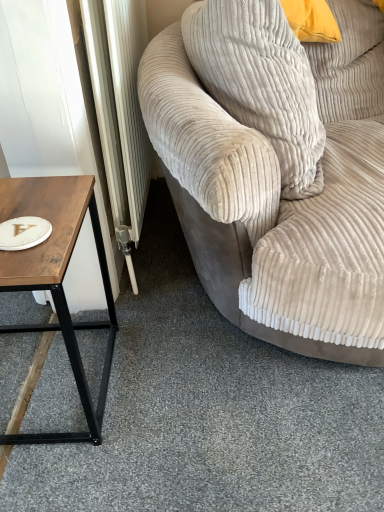
Question: In terms of size, does beige corduroy couch at right appear bigger or smaller than beige corduroy pillow at upper right?

Choices:
 (A) small
 (B) big

Answer: (B)

Question: From the image's perspective, is beige corduroy couch at right located above or below beige corduroy pillow at upper right?

Choices:
 (A) below
 (B) above

Answer: (A)

Question: Estimate the real-world distances between objects in this image. Which object is farther from the beige corduroy pillow at upper right?

Choices:
 (A) white matte paper plate at left
 (B) wooden table at left
 (C) beige corduroy couch at right

Answer: (A)

Question: Which is nearer to the wooden table at left?

Choices:
 (A) beige corduroy pillow at upper right
 (B) beige corduroy couch at right
 (C) white matte paper plate at left

Answer: (C)